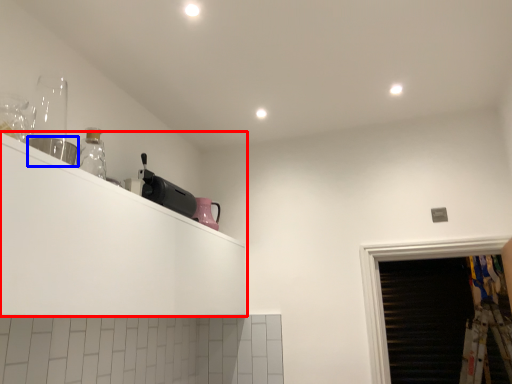
Question: Which object is further to the camera taking this photo, shelf (highlighted by a red box) or appliance (highlighted by a blue box)?

Choices:
 (A) shelf
 (B) appliance

Answer: (B)